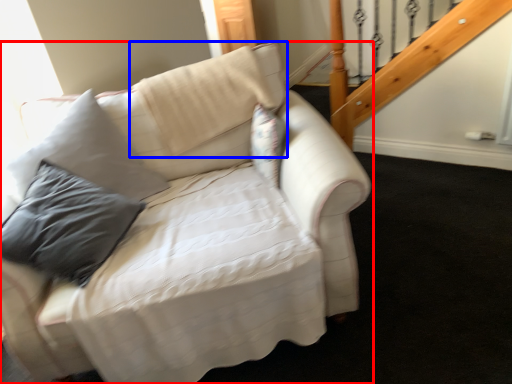
Question: Which point is closer to the camera, studio couch (highlighted by a red box) or pillow (highlighted by a blue box)?

Choices:
 (A) studio couch
 (B) pillow

Answer: (A)